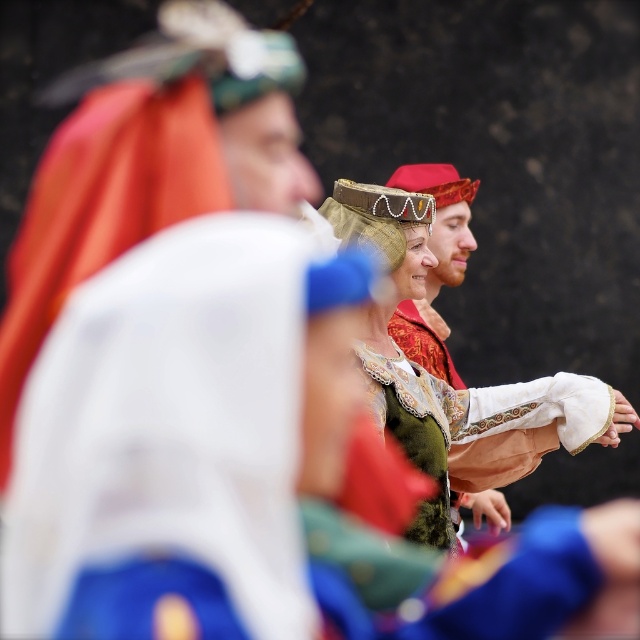
You are a photographer at the historical festival and want to capture a photo where the green velvet dress at center and the matte gold helmet at center are both clearly visible. Based on their positions, which object should you focus on to ensure both are in focus?

→ The green velvet dress at center is below the matte gold helmet at center, so focusing on the matte gold helmet at center would allow both to be in focus since it is higher up and closer to the background plane.

You are standing in the center of the image and want to move towards the green velvet dress at center. Which direction should you move relative to the point at coordinates point (x=218, y=461)?

The point at coordinates point (x=218, y=461) corresponds to the green velvet dress at center, so you are already at the location of the green velvet dress at center. Therefore, you don not need to move in any direction.

Consider the image. You are a photographer at a historical festival. You want to capture a photo where the green velvet dress at center is clearly visible without being blocked by the matte gold helmet at center. Based on the scene, is this possible?

Yes, because the green velvet dress at center is in front of the matte gold helmet at center, so it won not be blocked.